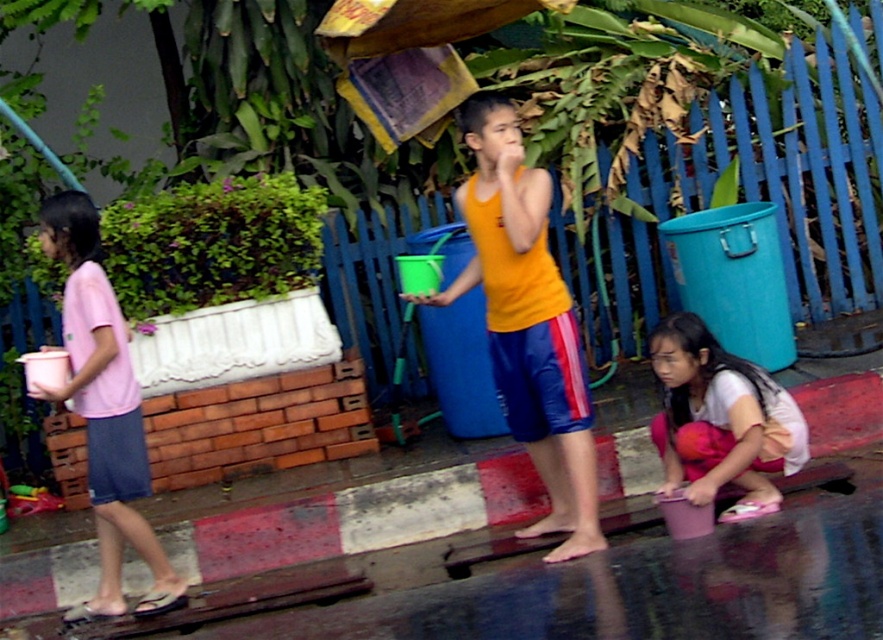
Question: Does orange matte tank top at center appear over pink matte bucket at left?

Choices:
 (A) yes
 (B) no

Answer: (A)

Question: Which point appears farthest from the camera in this image?

Choices:
 (A) (451, 296)
 (B) (91, 460)

Answer: (A)

Question: Which of the following is the closest to the observer?

Choices:
 (A) (540, 387)
 (B) (81, 387)

Answer: (B)

Question: Which point appears closest to the camera in this image?

Choices:
 (A) (552, 406)
 (B) (114, 497)
 (C) (663, 385)

Answer: (B)

Question: Is pink matte bucket at left positioned at the back of pink fabric skirt at lower right?

Choices:
 (A) yes
 (B) no

Answer: (B)

Question: Does orange matte tank top at center have a larger size compared to pink fabric skirt at lower right?

Choices:
 (A) yes
 (B) no

Answer: (A)